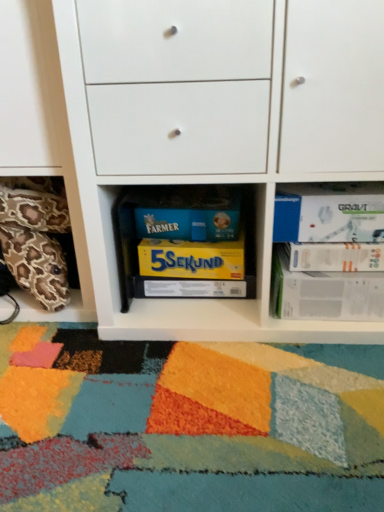
Where is `vacant area on top of white paper at right, acting as the second paperback book starting from the top (from a real-world perspective)`? This screenshot has height=512, width=384. vacant area on top of white paper at right, acting as the second paperback book starting from the top (from a real-world perspective) is located at coordinates (340, 242).